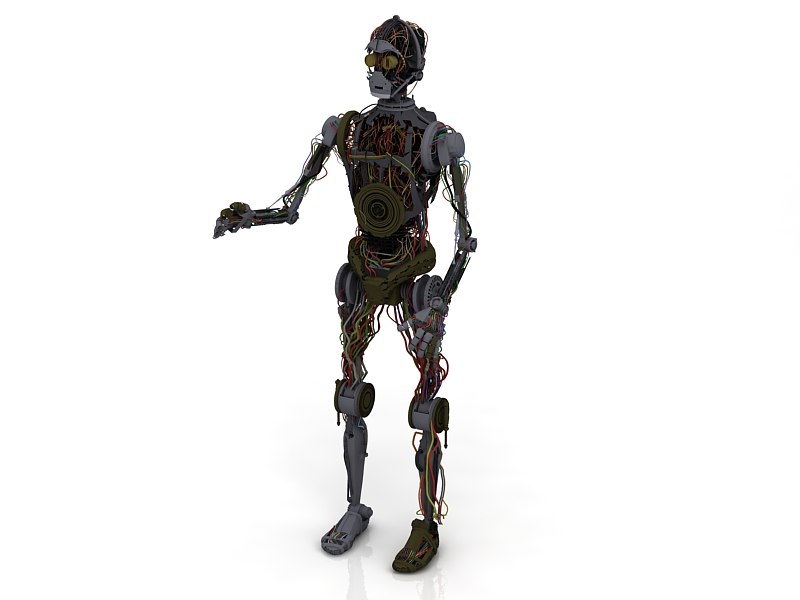
At what (x,y) coordinates should I click in order to perform the action: click on the chest. Please return your answer as a coordinate pair (x, y). Looking at the image, I should click on (384, 135).